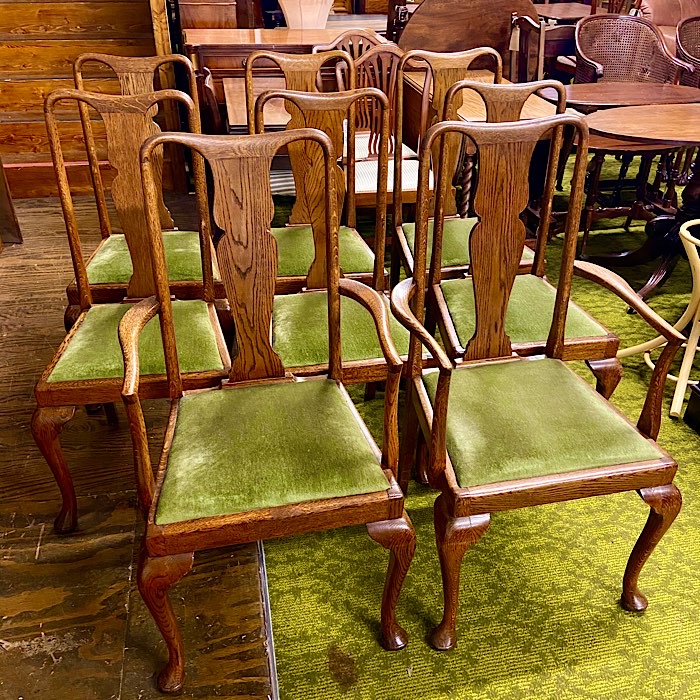
In order to click on green chairs in this screenshot , I will do `click(267, 498)`, `click(554, 440)`, `click(531, 315)`, `click(357, 323)`, `click(181, 328)`, `click(182, 252)`, `click(285, 242)`, `click(456, 232)`.